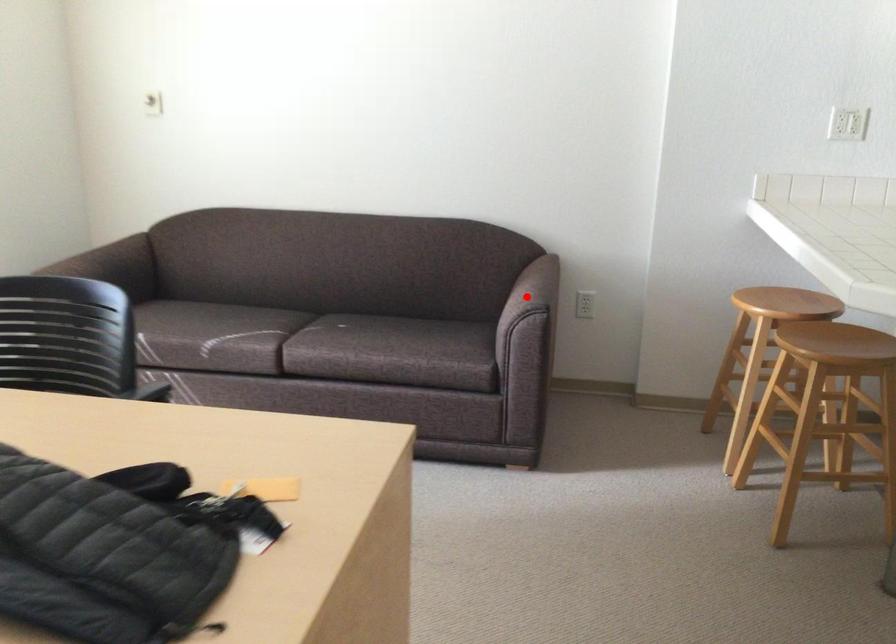
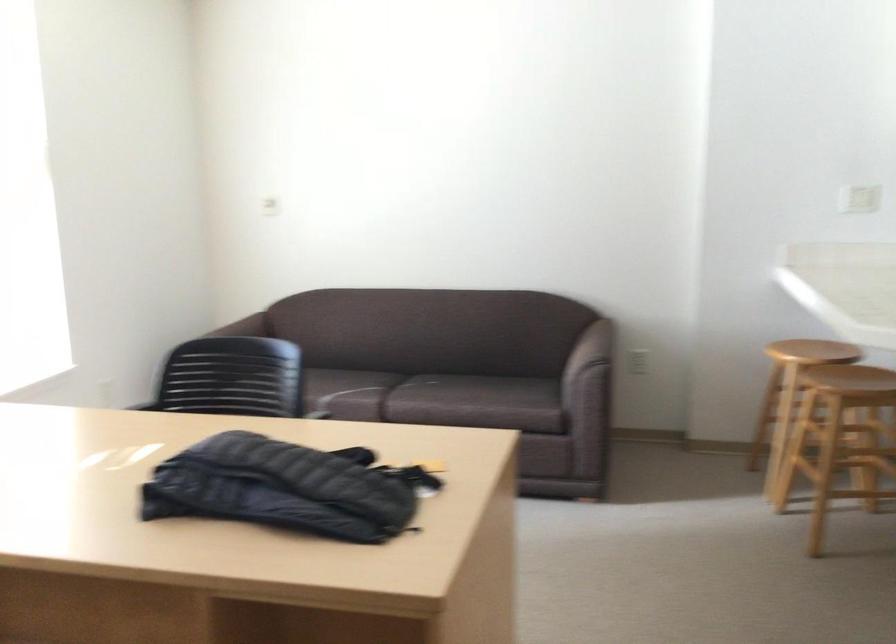
Question: I am providing you with two images of the same scene from different viewpoints. In image1, a red point is highlighted. Considering the same 3D point in image2, which of the following is correct?

Choices:
 (A) It is closer
 (B) It is farther

Answer: (B)